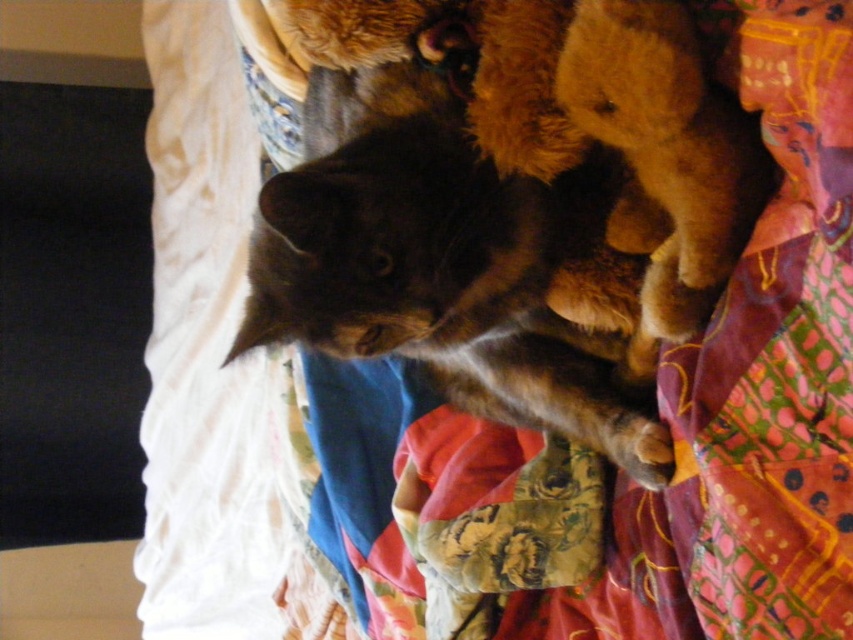
You are a photographer trying to capture the dark brown fur cat at center and the soft brown teddy bear at upper right in the same frame. Which object is closer to the camera?

The dark brown fur cat at center is closer to the camera because the soft brown teddy bear at upper right is positioned behind it.

You are a child who wants to hug both the dark brown fur cat at center and the soft brown teddy bear at upper right. Which one is wider so that you can give a bigger hug?

The dark brown fur cat at center is wider than the soft brown teddy bear at upper right, so you can give a bigger hug to the dark brown fur cat at center.

You are a child who wants to give a hug to the dark brown fur cat at center and the soft brown teddy bear at upper right. Which one is closer to you?

The dark brown fur cat at center is closer to you since it is positioned under the soft brown teddy bear at upper right, meaning the cat is nearer in the image.